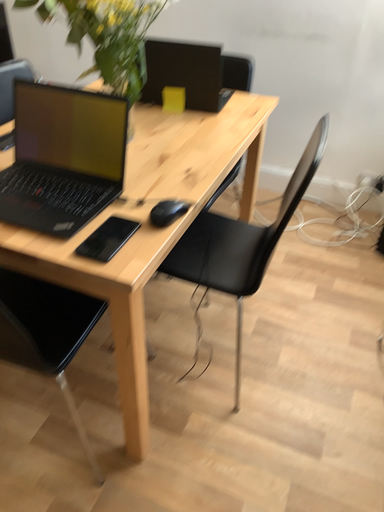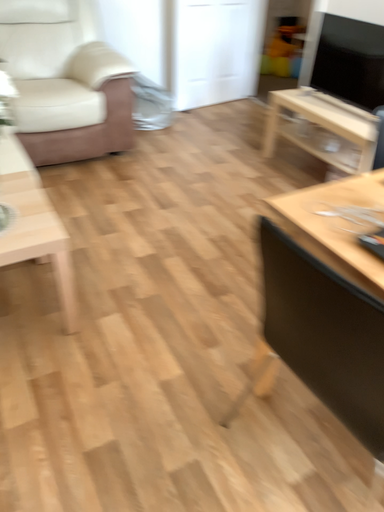
Question: Which way did the camera rotate in the video?

Choices:
 (A) rotated downward
 (B) rotated upward

Answer: (B)